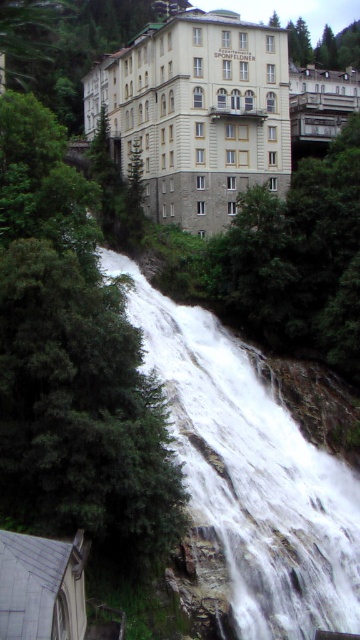
Question: Is white frothy water at center smaller than matte white balcony at upper center?

Choices:
 (A) no
 (B) yes

Answer: (B)

Question: Is white frothy water at center to the right of gray slate roof at lower left from the viewer's perspective?

Choices:
 (A) yes
 (B) no

Answer: (A)

Question: Which point appears farthest from the camera in this image?

Choices:
 (A) (69, 611)
 (B) (284, 460)
 (C) (315, 138)

Answer: (C)

Question: Which point appears farthest from the camera in this image?

Choices:
 (A) (308, 92)
 (B) (221, 45)
 (C) (16, 460)

Answer: (A)

Question: Which object appears closest to the camera in this image?

Choices:
 (A) white stone building at center
 (B) green leafy tree at left

Answer: (B)

Question: Is gray slate roof at lower left bigger than matte white balcony at upper center?

Choices:
 (A) no
 (B) yes

Answer: (A)